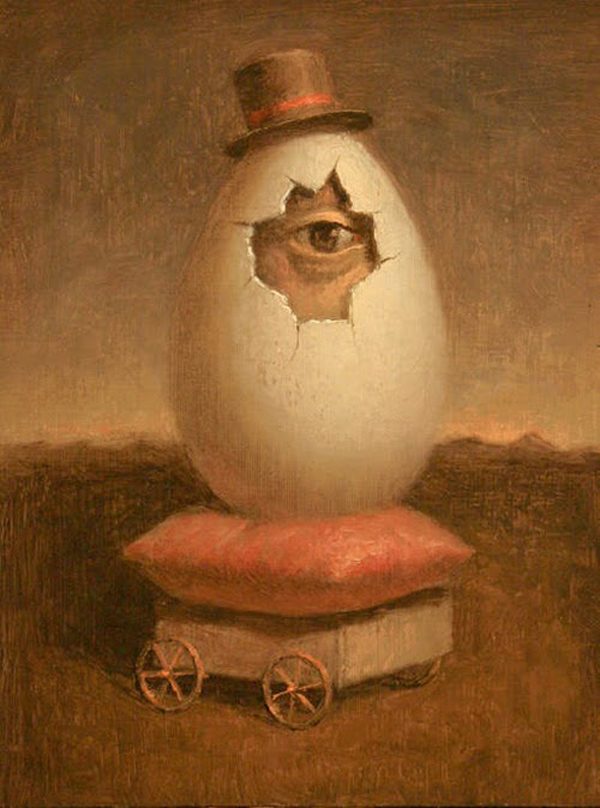
This screenshot has height=808, width=600. I want to click on red pillow, so click(335, 558).